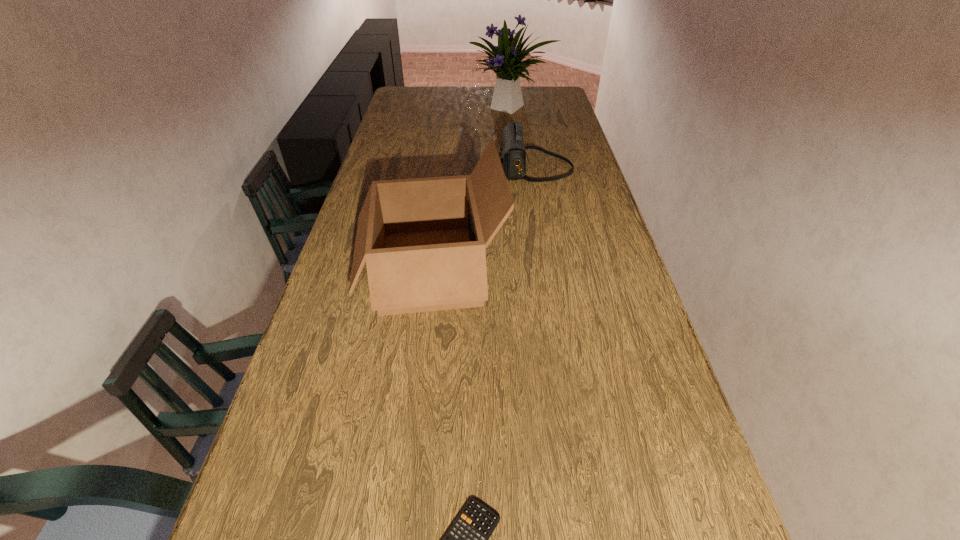
Locate an element on the screen. This screenshot has height=540, width=960. the farthest object is located at coordinates [507, 97].

Find the location of a particular element. This screenshot has height=540, width=960. the tallest object is located at coordinates (507, 97).

I want to click on box, so click(423, 239).

You are a GUI agent. You are given a task and a screenshot of the screen. Output one action in this format:
    pyautogui.click(x=<x>, y=<y>)
    Task: Click on the second nearest object
    
    Given the screenshot: What is the action you would take?
    pyautogui.click(x=423, y=239)

Locate an element on the screen. the second farthest object is located at coordinates (512, 151).

In order to click on shoulder bag in this screenshot , I will do `click(512, 151)`.

Identify the location of vacant space located 0.140m on the front of the flower arrangement. The width and height of the screenshot is (960, 540). (516, 140).

Find the location of a particular element. The height and width of the screenshot is (540, 960). free spot located 0.130m on the right of the third farthest object is located at coordinates (552, 270).

Image resolution: width=960 pixels, height=540 pixels. I want to click on vacant space positioned 0.370m on the back of the third nearest object, so click(525, 114).

At what (x,y) coordinates should I click in order to perform the action: click on object positioned at the far edge. Please return your answer as a coordinate pair (x, y). This screenshot has width=960, height=540. Looking at the image, I should click on (507, 97).